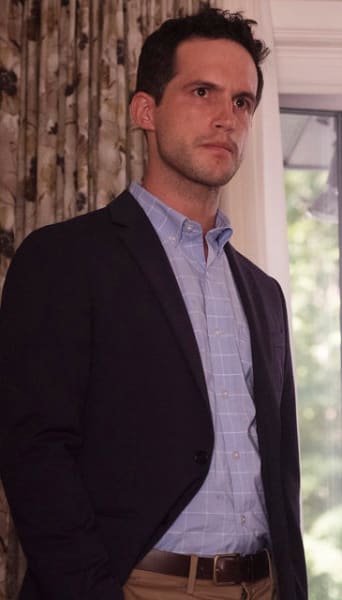
Find the location of a particular element. door is located at coordinates (311, 328).